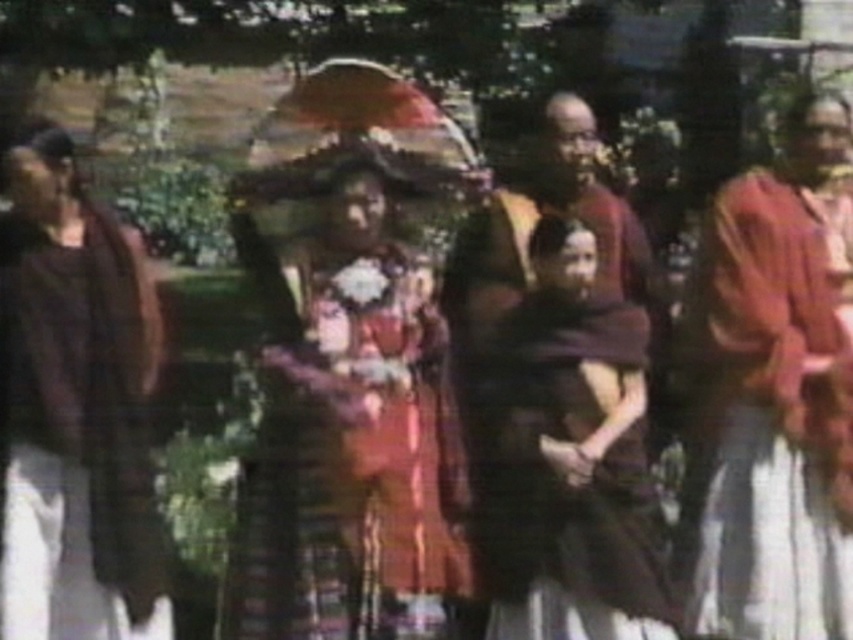
Does silky pink dress at right have a greater width compared to matte brown dress at left?

Incorrect, silky pink dress at right's width does not surpass matte brown dress at left's.

Looking at this image, how much distance is there between silky pink dress at right and matte brown dress at left?

silky pink dress at right and matte brown dress at left are 5.86 meters apart from each other.

Which is behind, point (764, 458) or point (25, 445)?

The point (764, 458) is behind.

You are a GUI agent. You are given a task and a screenshot of the screen. Output one action in this format:
    pyautogui.click(x=<x>, y=<y>)
    Task: Click on the silky pink dress at right
    Image resolution: width=853 pixels, height=640 pixels.
    Given the screenshot: What is the action you would take?
    (781, 413)

Who is higher up, textured fabric dress at center or matte brown dress at left?

Positioned higher is textured fabric dress at center.

Is textured fabric dress at center wider than matte brown dress at left?

Yes.

The height and width of the screenshot is (640, 853). What do you see at coordinates (384, 394) in the screenshot? I see `textured fabric dress at center` at bounding box center [384, 394].

Find the location of `textured fabric dress at center`. textured fabric dress at center is located at coordinates (384, 394).

Is dark brown fabric shawl at center shorter than matte brown dress at left?

Yes, dark brown fabric shawl at center is shorter than matte brown dress at left.

At what (x,y) coordinates should I click in order to perform the action: click on dark brown fabric shawl at center. Please return your answer as a coordinate pair (x, y). Looking at the image, I should click on (569, 456).

The height and width of the screenshot is (640, 853). Find the location of `dark brown fabric shawl at center`. dark brown fabric shawl at center is located at coordinates (569, 456).